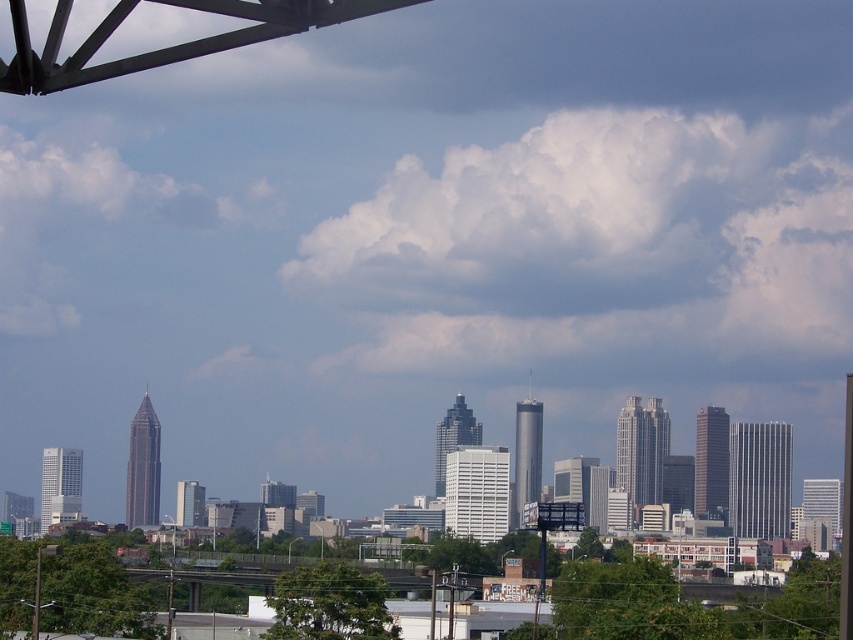
Question: Does white fluffy cloud at upper center have a smaller size compared to white fluffy cloud at upper left?

Choices:
 (A) no
 (B) yes

Answer: (A)

Question: Which of the following is the closest to the observer?

Choices:
 (A) white fluffy cloud at upper left
 (B) white fluffy cloud at upper center

Answer: (B)

Question: Can you confirm if white fluffy cloud at upper center is positioned below white fluffy cloud at upper left?

Choices:
 (A) no
 (B) yes

Answer: (B)

Question: Which object appears farthest from the camera in this image?

Choices:
 (A) white fluffy cloud at upper left
 (B) white fluffy cloud at upper center

Answer: (A)

Question: Does white fluffy cloud at upper center appear over white fluffy cloud at upper left?

Choices:
 (A) yes
 (B) no

Answer: (B)